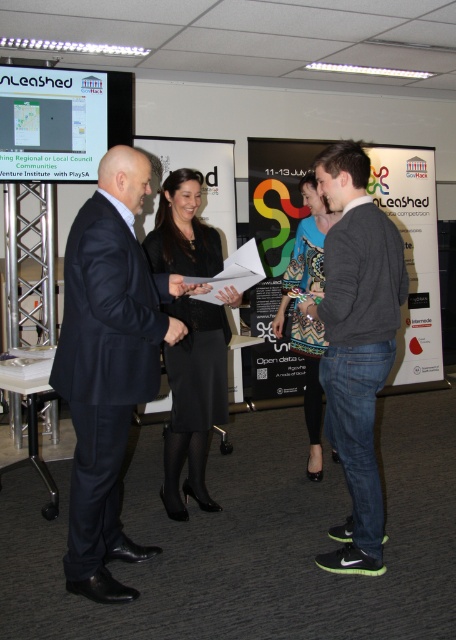
Question: Which point is closer to the camera?

Choices:
 (A) (68, 396)
 (B) (214, 252)
 (C) (97, 138)

Answer: (A)

Question: Which point is farther to the camera?

Choices:
 (A) matte black screen at upper left
 (B) dark blue suit at center

Answer: (A)

Question: Does dark blue suit at center have a smaller size compared to matte black screen at upper left?

Choices:
 (A) yes
 (B) no

Answer: (B)

Question: Is matte black poster at center below printed fabric dress at center?

Choices:
 (A) no
 (B) yes

Answer: (A)

Question: Is black satin skirt at center behind matte black screen at upper left?

Choices:
 (A) yes
 (B) no

Answer: (B)

Question: Which point is farther from the camera taking this photo?

Choices:
 (A) (385, 154)
 (B) (181, 234)

Answer: (A)